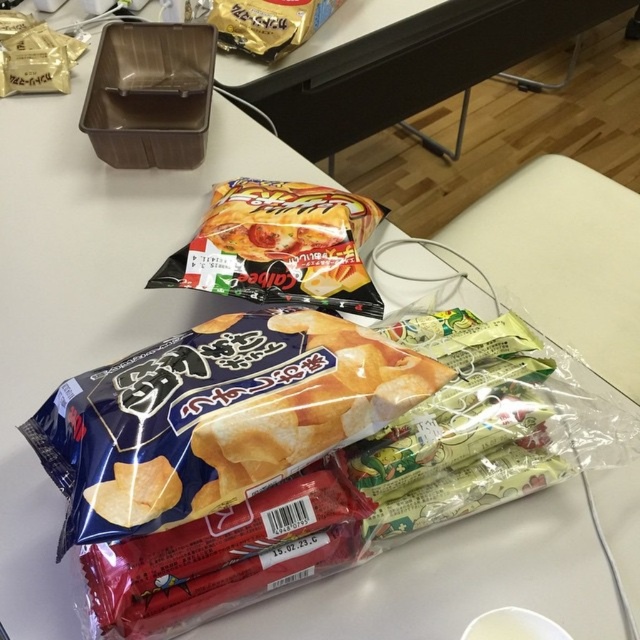
Does shiny plastic bag of chips at center have a smaller size compared to gold foil snack at upper center?

Actually, shiny plastic bag of chips at center might be larger than gold foil snack at upper center.

Can you confirm if shiny plastic bag of chips at center is positioned above gold foil snack at upper center?

No.

I want to click on shiny plastic bag of chips at center, so click(280, 246).